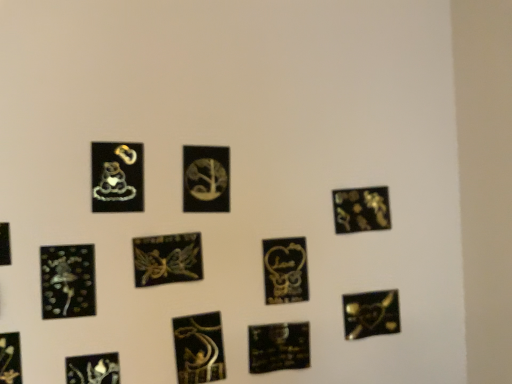
Question: In terms of size, does gold metallic heart at lower right, arranged as the first picture frame when viewed from the right, appear bigger or smaller than black glossy picture frame at lower center, which is the 9th picture frame in left-to-right order?

Choices:
 (A) big
 (B) small

Answer: (A)

Question: From a real-world perspective, relative to black glossy picture frame at lower center, the 4th picture frame positioned from the right, is gold metallic heart at lower right, arranged as the first picture frame when viewed from the right, vertically above or below?

Choices:
 (A) below
 (B) above

Answer: (B)

Question: Estimate the real-world distances between objects in this image. Which object is farther from the matte black sticker at center, positioned as the 6th picture frame in right-to-left order?

Choices:
 (A) gold metallic heart at lower right, the twelfth picture frame viewed from the left
 (B) glossy black clock at lower left, the third picture frame when ordered from left to right
 (C) matte gold clock at center, the fifth picture frame in the right-to-left sequence
 (D) metallic gold fairy at center, the seventh picture frame when ordered from right to left
 (E) metallic gold flower at bottom left, positioned as the 2th picture frame in left-to-right order

Answer: (A)

Question: Considering the real-world distances, which object is farthest from the gold metallic heart at lower right, the twelfth picture frame viewed from the left?

Choices:
 (A) matte gold heart at center, which ranks as the third picture frame in right-to-left order
 (B) matte gold clock at center, which is the eighth picture frame in left-to-right order
 (C) metallic gold flower at bottom left, the eleventh picture frame in the right-to-left sequence
 (D) black glossy picture frame at lower left, which is counted as the 12th picture frame, starting from the right
 (E) matte gold charm at upper left, placed as the 5th picture frame when sorted from left to right

Answer: (D)